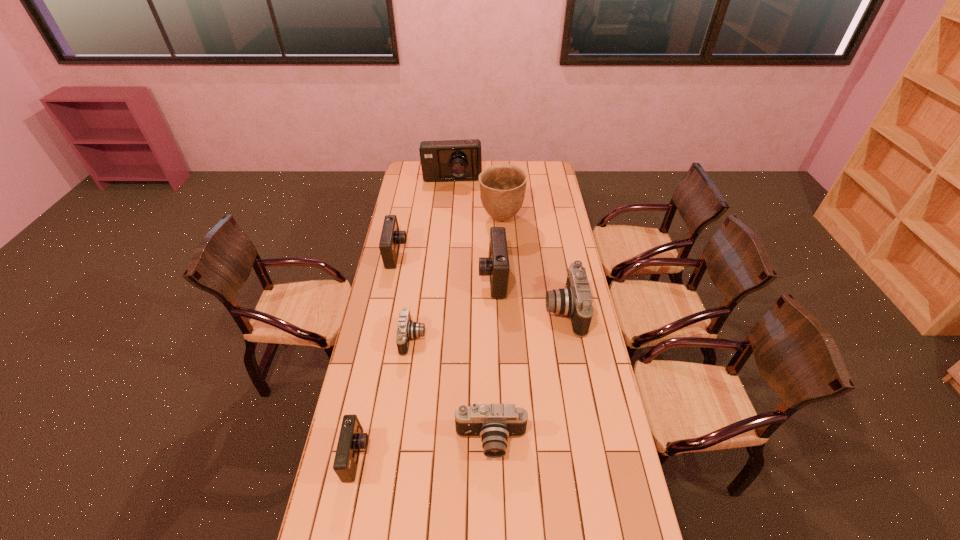
You are a GUI agent. You are given a task and a screenshot of the screen. Output one action in this format:
    pyautogui.click(x=<x>, y=<y>)
    Task: Click on the free space between the smallest blue camera and the pottery
    The height and width of the screenshot is (540, 960).
    Given the screenshot: What is the action you would take?
    pyautogui.click(x=429, y=338)

You are a GUI agent. You are given a task and a screenshot of the screen. Output one action in this format:
    pyautogui.click(x=<x>, y=<y>)
    Task: Click on the free spot between the seventh nearest object and the leftmost black camera
    
    Given the screenshot: What is the action you would take?
    pyautogui.click(x=457, y=279)

Image resolution: width=960 pixels, height=540 pixels. Identify the location of free space between the smallest black camera and the third biggest blue camera. (404, 296).

Locate an element on the screen. The image size is (960, 540). vacant space that is in between the rightmost black camera and the smallest blue camera is located at coordinates (461, 383).

What are the coordinates of `free space between the seventh nearest object and the farthest camera` in the screenshot? It's located at (477, 200).

You are a GUI agent. You are given a task and a screenshot of the screen. Output one action in this format:
    pyautogui.click(x=<x>, y=<y>)
    Task: Click on the free space between the smallest blue camera and the second smallest blue camera
    This screenshot has width=960, height=540.
    Given the screenshot: What is the action you would take?
    pyautogui.click(x=376, y=355)

Image resolution: width=960 pixels, height=540 pixels. Identify the location of free space between the second smallest blue camera and the leftmost black camera. (404, 296).

Locate which object is the third closest to the rightmost object. Please provide its 2D coordinates. Your answer should be formatted as a tuple, i.e. [(x, y)], where the tuple contains the x and y coordinates of a point satisfying the conditions above.

[(502, 187)]

Identify which object is the fifth closest to the smallest black camera. Please provide its 2D coordinates. Your answer should be formatted as a tuple, i.e. [(x, y)], where the tuple contains the x and y coordinates of a point satisfying the conditions above.

[(575, 300)]

You are a GUI agent. You are given a task and a screenshot of the screen. Output one action in this format:
    pyautogui.click(x=<x>, y=<y>)
    Task: Click on the camera object that ranks as the fifth closest to the biggest blue camera
    
    Given the screenshot: What is the action you would take?
    pyautogui.click(x=494, y=423)